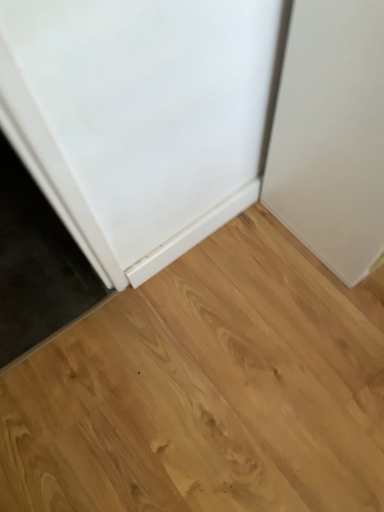
Question: Is white matte door at upper right situated inside natural wood floor at center or outside?

Choices:
 (A) outside
 (B) inside

Answer: (A)

Question: Is point (327, 225) positioned closer to the camera than point (48, 354)?

Choices:
 (A) farther
 (B) closer

Answer: (B)

Question: In terms of height, does white matte door at upper right look taller or shorter compared to natural wood floor at center?

Choices:
 (A) tall
 (B) short

Answer: (A)

Question: From a real-world perspective, is natural wood floor at center positioned above or below white matte door at upper right?

Choices:
 (A) below
 (B) above

Answer: (A)

Question: In terms of width, does natural wood floor at center look wider or thinner when compared to white matte door at upper right?

Choices:
 (A) wide
 (B) thin

Answer: (A)

Question: From the image's perspective, is natural wood floor at center positioned above or below white matte door at upper right?

Choices:
 (A) below
 (B) above

Answer: (A)

Question: Is natural wood floor at center taller or shorter than white matte door at upper right?

Choices:
 (A) tall
 (B) short

Answer: (B)